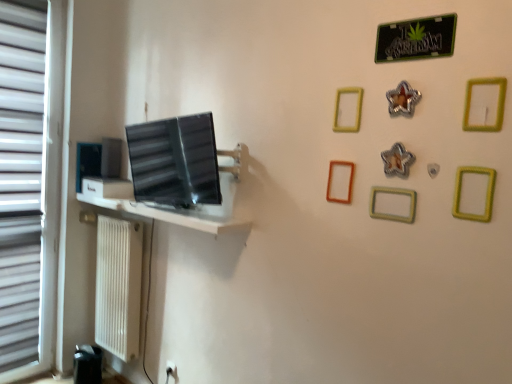
Question: Considering the relative positions of green metallic sign at upper right and yellow matte picture frame at upper center, acting as the sixth picture frame starting from the right, in the image provided, is green metallic sign at upper right behind yellow matte picture frame at upper center, acting as the sixth picture frame starting from the right,?

Choices:
 (A) yes
 (B) no

Answer: (B)

Question: Is green metallic sign at upper right to the right of yellow matte picture frame at upper center, which is counted as the sixth picture frame, starting from the front, from the viewer's perspective?

Choices:
 (A) yes
 (B) no

Answer: (A)

Question: Is yellow matte picture frame at upper center, acting as the sixth picture frame starting from the right, inside green metallic sign at upper right?

Choices:
 (A) no
 (B) yes

Answer: (A)

Question: From a real-world perspective, is green metallic sign at upper right under yellow matte picture frame at upper center, which is counted as the 3th picture frame, starting from the back?

Choices:
 (A) no
 (B) yes

Answer: (A)

Question: Does green metallic sign at upper right have a larger size compared to yellow matte picture frame at upper center, acting as the sixth picture frame starting from the right?

Choices:
 (A) no
 (B) yes

Answer: (B)

Question: Does green metallic sign at upper right turn towards yellow matte picture frame at upper center, which is counted as the 3th picture frame, starting from the back?

Choices:
 (A) yes
 (B) no

Answer: (B)

Question: Is silver metallic star at upper center, marked as the 3th picture frame in a right-to-left arrangement, at the left side of matte black picture frame at left, acting as the first picture frame starting from the back?

Choices:
 (A) yes
 (B) no

Answer: (B)

Question: Is matte black picture frame at left, the 1th picture frame from the left, inside silver metallic star at upper center, the third picture frame when ordered from front to back?

Choices:
 (A) no
 (B) yes

Answer: (A)

Question: From the image's perspective, would you say silver metallic star at upper center, arranged as the sixth picture frame when viewed from the back, is shown under matte black picture frame at left, acting as the first picture frame starting from the back?

Choices:
 (A) yes
 (B) no

Answer: (B)

Question: Is the position of silver metallic star at upper center, the third picture frame when ordered from front to back, more distant than that of matte black picture frame at left, acting as the first picture frame starting from the back?

Choices:
 (A) yes
 (B) no

Answer: (B)

Question: Considering the relative sizes of silver metallic star at upper center, arranged as the sixth picture frame when viewed from the back, and matte black picture frame at left, acting as the first picture frame starting from the back, in the image provided, is silver metallic star at upper center, arranged as the sixth picture frame when viewed from the back, smaller than matte black picture frame at left, acting as the first picture frame starting from the back,?

Choices:
 (A) yes
 (B) no

Answer: (A)

Question: Is silver metallic star at upper center, which is counted as the sixth picture frame, starting from the left, positioned with its back to matte black picture frame at left, acting as the first picture frame starting from the back?

Choices:
 (A) no
 (B) yes

Answer: (A)

Question: Is white plastic blind at left shorter than metallic star at upper center, the 4th picture frame from the right?

Choices:
 (A) no
 (B) yes

Answer: (A)